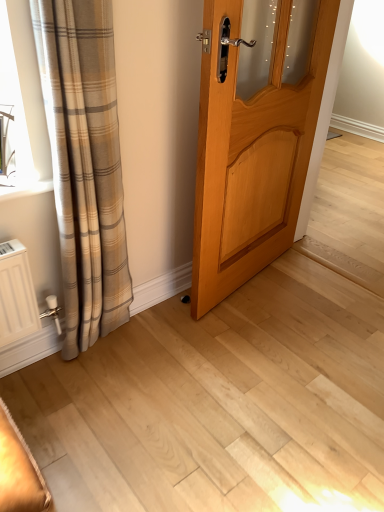
Question: Should I look upward or downward to see light wood door at center?

Choices:
 (A) up
 (B) down

Answer: (A)

Question: Considering the relative positions of light wood door at center and plaid fabric curtain at left in the image provided, is light wood door at center in front of plaid fabric curtain at left?

Choices:
 (A) yes
 (B) no

Answer: (B)

Question: Is light wood door at center surrounding plaid fabric curtain at left?

Choices:
 (A) yes
 (B) no

Answer: (B)

Question: Is light wood door at center not near plaid fabric curtain at left?

Choices:
 (A) no
 (B) yes

Answer: (A)

Question: Can you confirm if light wood door at center is wider than plaid fabric curtain at left?

Choices:
 (A) yes
 (B) no

Answer: (B)

Question: Does light wood door at center appear on the right side of plaid fabric curtain at left?

Choices:
 (A) yes
 (B) no

Answer: (A)

Question: Is light wood door at center at the left side of plaid fabric curtain at left?

Choices:
 (A) yes
 (B) no

Answer: (B)

Question: Does plaid fabric curtain at left have a greater height compared to light wood door at center?

Choices:
 (A) yes
 (B) no

Answer: (A)

Question: Is plaid fabric curtain at left facing away from light wood door at center?

Choices:
 (A) yes
 (B) no

Answer: (B)

Question: Is the position of plaid fabric curtain at left more distant than that of light wood door at center?

Choices:
 (A) yes
 (B) no

Answer: (B)

Question: Could you tell me if plaid fabric curtain at left is facing light wood door at center?

Choices:
 (A) no
 (B) yes

Answer: (A)

Question: From a real-world perspective, is plaid fabric curtain at left below light wood door at center?

Choices:
 (A) no
 (B) yes

Answer: (B)

Question: Is plaid fabric curtain at left at the right side of light wood door at center?

Choices:
 (A) no
 (B) yes

Answer: (A)

Question: Which is correct: plaid fabric curtain at left is inside light wood door at center, or outside of it?

Choices:
 (A) inside
 (B) outside

Answer: (B)